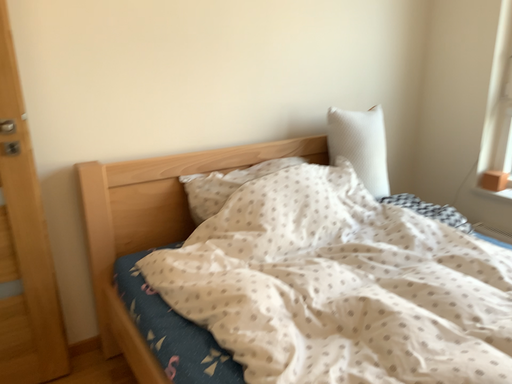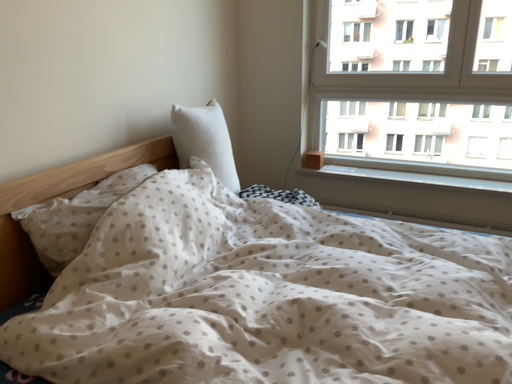
Question: How did the camera likely rotate when shooting the video?

Choices:
 (A) rotated right
 (B) rotated left

Answer: (A)